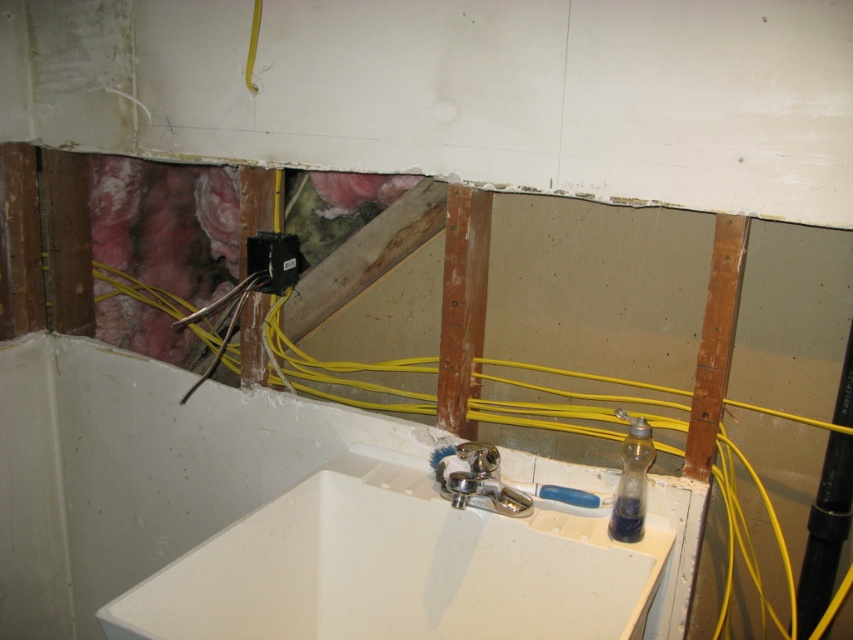
Does white ceramic sink at center appear over rusty wood beam at center?

No, white ceramic sink at center is not above rusty wood beam at center.

Where is `white ceramic sink at center`? white ceramic sink at center is located at coordinates (270, 520).